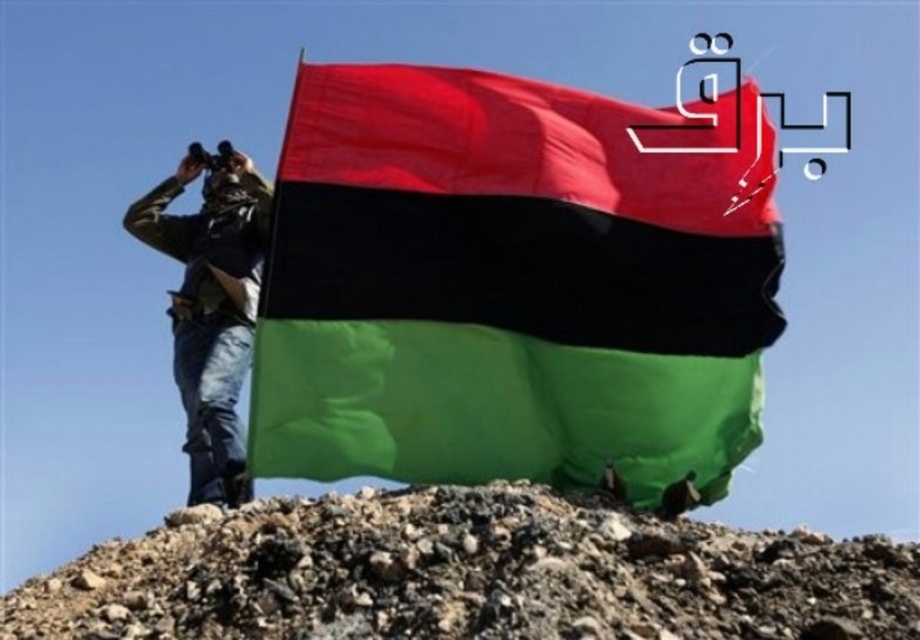
Does polyester flag at center appear under rough gravel hill at center?

No.

The image size is (920, 640). What are the coordinates of `polyester flag at center` in the screenshot? It's located at (515, 284).

Can you confirm if polyester flag at center is wider than camouflage fabric jacket at center?

Indeed, polyester flag at center has a greater width compared to camouflage fabric jacket at center.

Who is positioned more to the left, polyester flag at center or camouflage fabric jacket at center?

From the viewer's perspective, camouflage fabric jacket at center appears more on the left side.

Is point (346, 237) positioned before point (249, 292)?

Yes, point (346, 237) is in front of point (249, 292).

Identify the location of polyester flag at center. (515, 284).

Is point (601, 554) farther from viewer compared to point (237, 224)?

That is False.

Is rough gravel hill at center positioned in front of camouflage fabric jacket at center?

Yes, it is in front of camouflage fabric jacket at center.

Does point (243, 563) come in front of point (135, 214)?

That is True.

Find the location of a particular element. This screenshot has width=920, height=640. rough gravel hill at center is located at coordinates tap(468, 573).